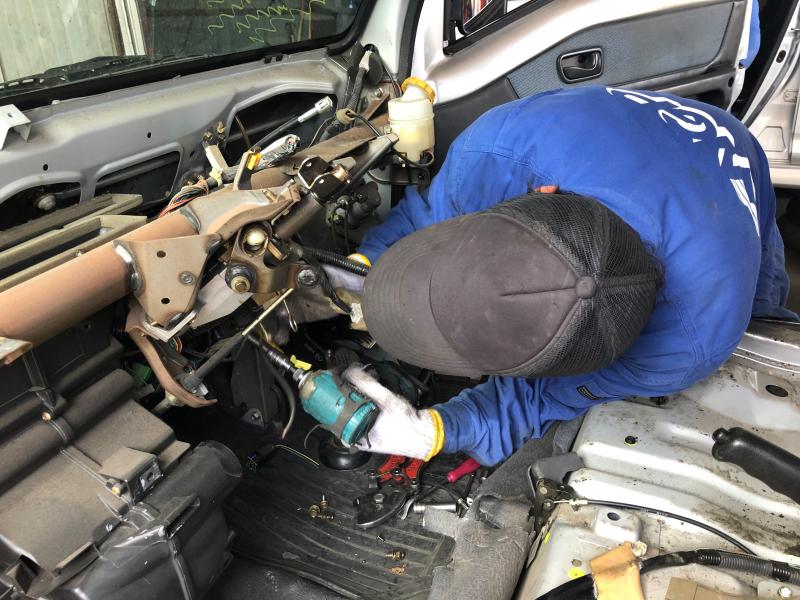
Identify the location of door. The image size is (800, 600). (706, 33).